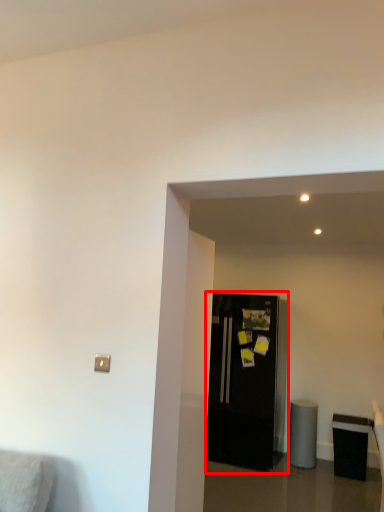
Question: From the image's perspective, where is refrigerator (annotated by the red box) located relative to furniture?

Choices:
 (A) below
 (B) above

Answer: (B)